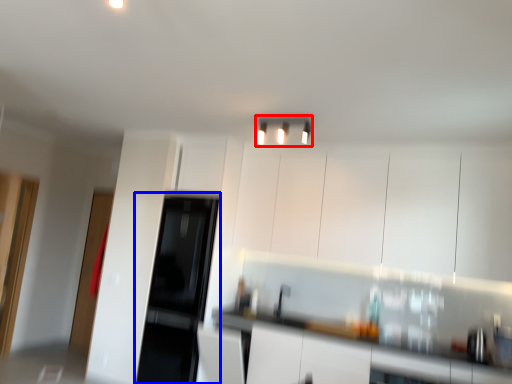
Question: Which point is closer to the camera, light fixture (highlighted by a red box) or appliance (highlighted by a blue box)?

Choices:
 (A) light fixture
 (B) appliance

Answer: (A)